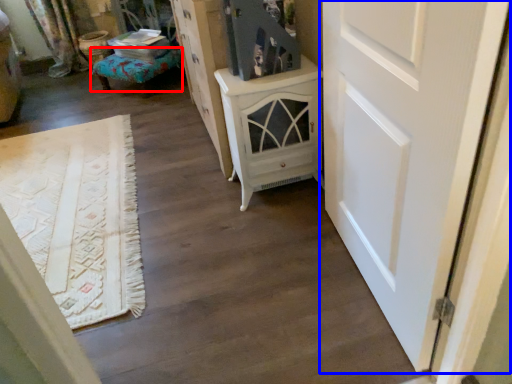
Question: Which of the following is the closest to the observer, furniture (highlighted by a red box) or door (highlighted by a blue box)?

Choices:
 (A) furniture
 (B) door

Answer: (B)